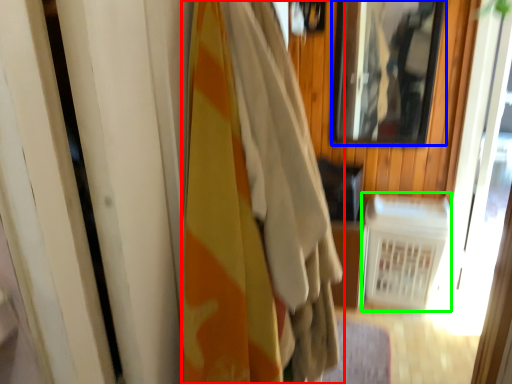
Question: Which object is positioned closest to curtain (highlighted by a red box)? Select from mirror (highlighted by a blue box) and radiator (highlighted by a green box).

Choices:
 (A) mirror
 (B) radiator

Answer: (B)